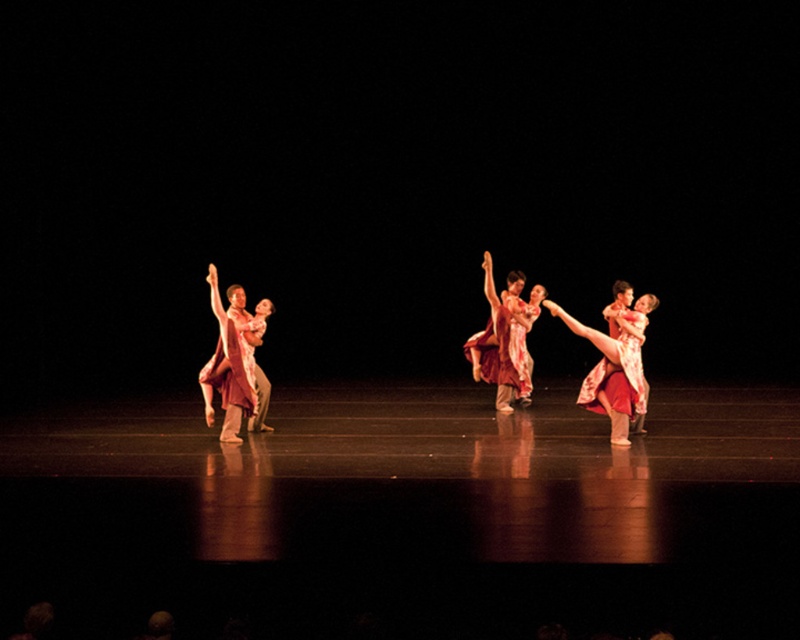
Question: Which of the following is the closest to the observer?

Choices:
 (A) (625, 365)
 (B) (510, 380)

Answer: (A)

Question: Which of the following is the closest to the observer?

Choices:
 (A) (496, 307)
 (B) (604, 376)

Answer: (B)

Question: Does matte pink dress at right appear on the right side of matte red dress at center?

Choices:
 (A) yes
 (B) no

Answer: (A)

Question: Is matte pink dress at right positioned at the back of matte red dress at center?

Choices:
 (A) no
 (B) yes

Answer: (A)

Question: Which point is farther to the camera?

Choices:
 (A) (500, 406)
 (B) (620, 413)

Answer: (A)

Question: Is matte pink dress at right further to camera compared to matte red dress at center?

Choices:
 (A) no
 (B) yes

Answer: (A)